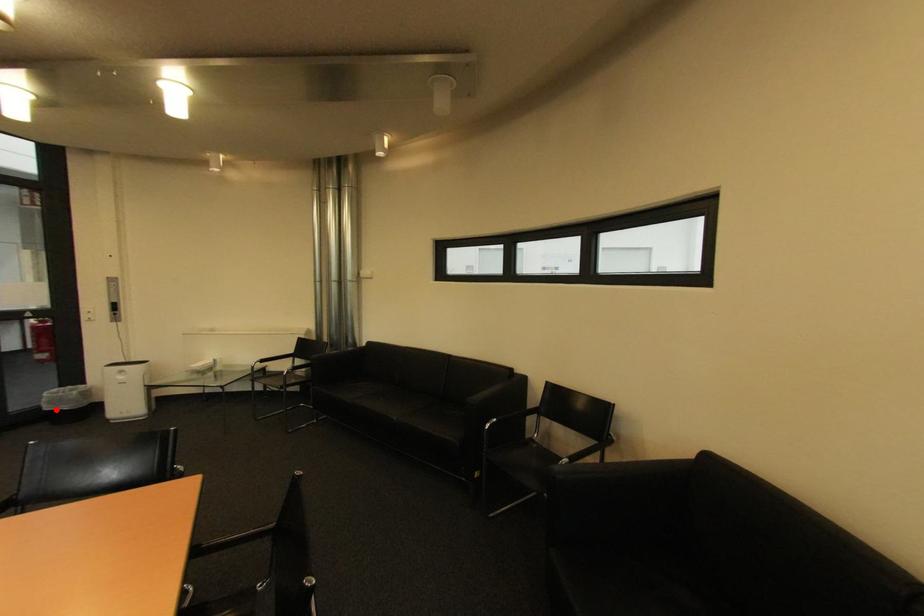
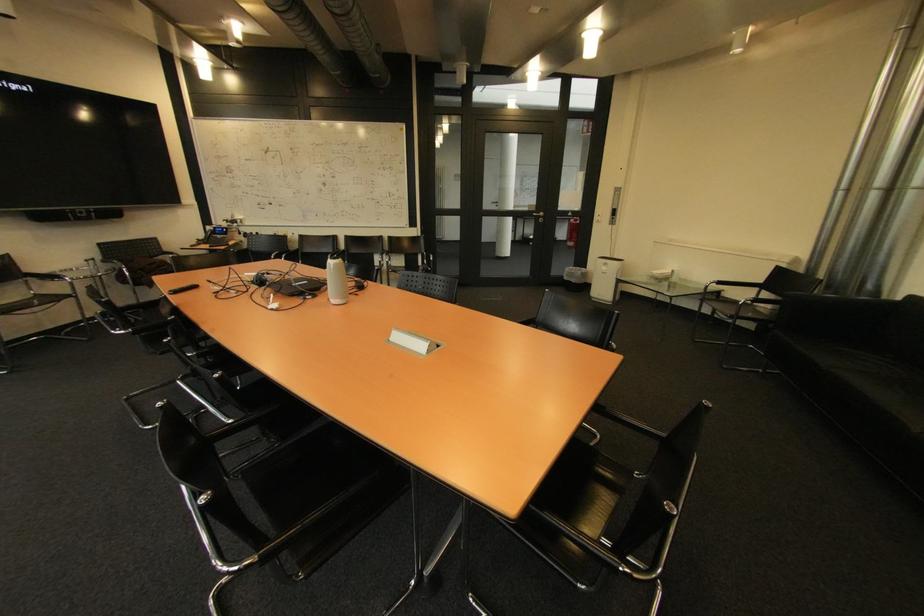
Question: I am providing you with two images of the same scene from different viewpoints. A red point is shown in image1. For the corresponding object point in image2, is it positioned nearer or farther from the camera?

Choices:
 (A) Nearer
 (B) Farther

Answer: (A)